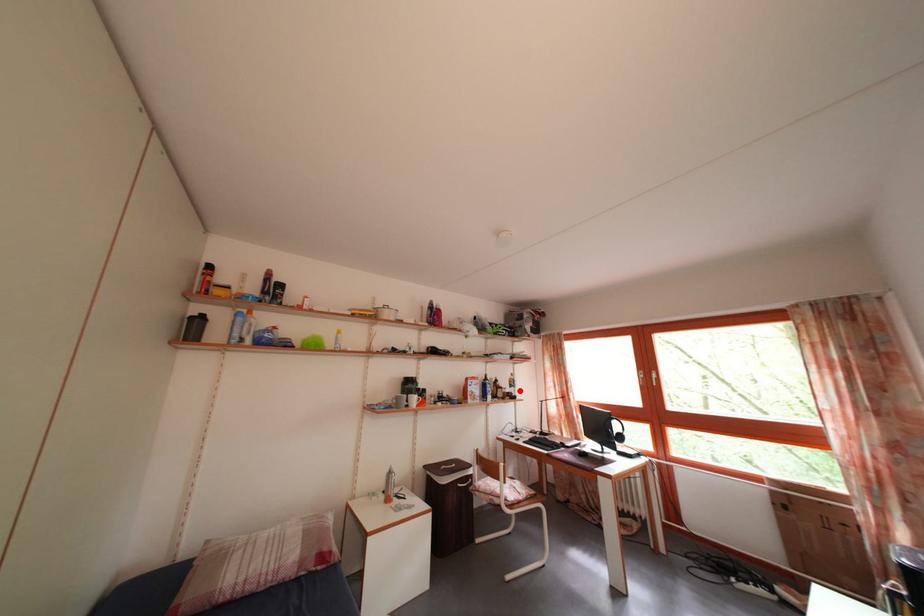
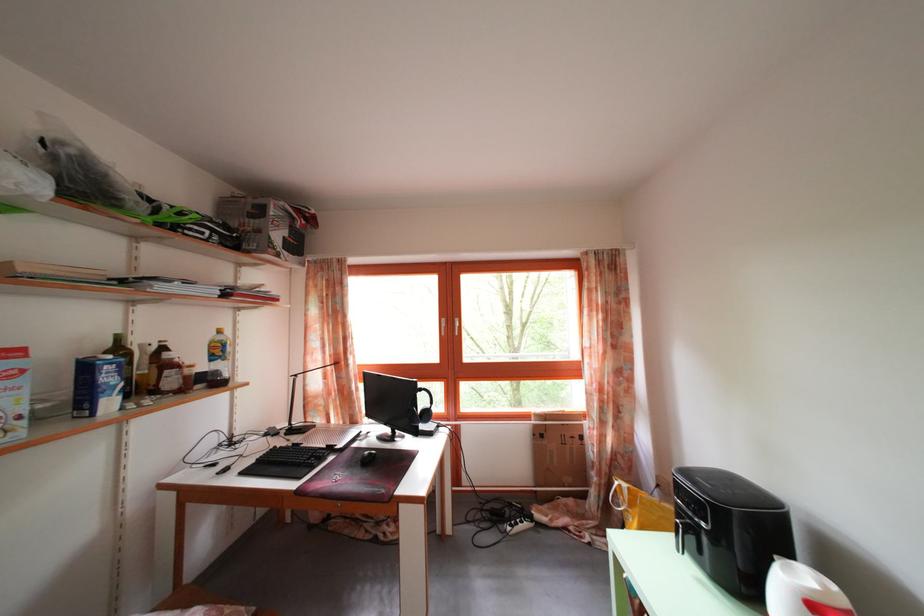
Where in the second image is the point corresponding to the highlighted location from the first image?

(225, 359)